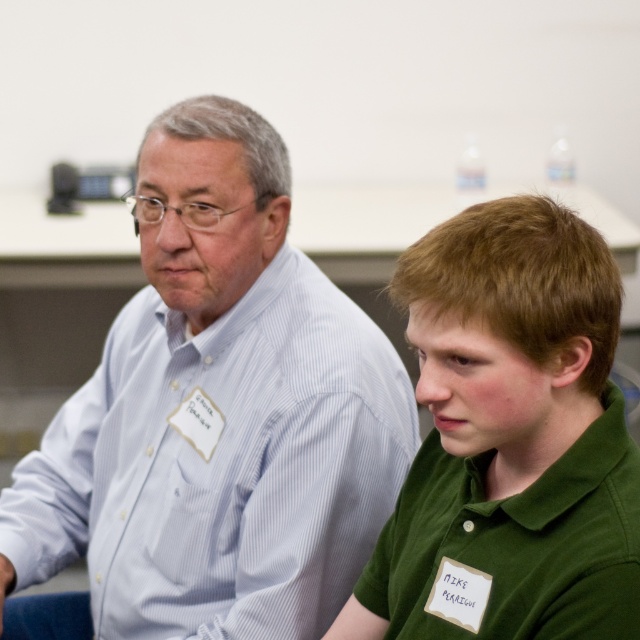
Which is more to the right, light blue striped shirt at left or green matte shirt at right?

Positioned to the right is green matte shirt at right.

Does light blue striped shirt at left have a greater height compared to green matte shirt at right?

Yes.

Does point (157, 392) come in front of point (474, 433)?

No, it is behind (474, 433).

The height and width of the screenshot is (640, 640). Find the location of `light blue striped shirt at left`. light blue striped shirt at left is located at coordinates (212, 419).